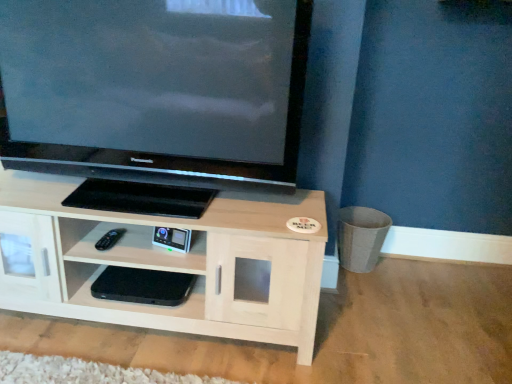
Question: Would you say black plastic remote at lower left is to the left or to the right of matte black television at upper left in the picture?

Choices:
 (A) right
 (B) left

Answer: (B)

Question: Considering the positions of point (117, 238) and point (143, 36), is point (117, 238) closer or farther from the camera than point (143, 36)?

Choices:
 (A) closer
 (B) farther

Answer: (B)

Question: Which of these objects is positioned closest to the black matte console at center, the 2th shelf positioned from the top?

Choices:
 (A) light wood shelf at center, acting as the 2th shelf starting from the bottom
 (B) black plastic remote at lower left
 (C) matte black television at upper left

Answer: (A)

Question: Which is farther from the matte black television at upper left?

Choices:
 (A) light wood shelf at center, the first shelf from the top
 (B) black plastic remote at lower left
 (C) black matte console at center, the 2th shelf positioned from the top

Answer: (B)